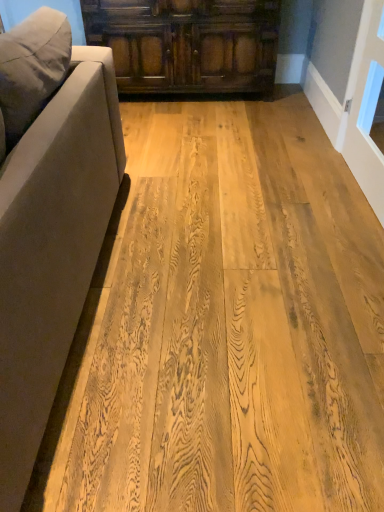
Question: In the image, is natural wood floor at center on the left side or the right side of suede-like beige couch at left?

Choices:
 (A) right
 (B) left

Answer: (A)

Question: Considering the positions of natural wood floor at center and suede-like beige couch at left in the image, is natural wood floor at center bigger or smaller than suede-like beige couch at left?

Choices:
 (A) big
 (B) small

Answer: (B)

Question: Estimate the real-world distances between objects in this image. Which object is closer to the suede-like beige couch at left?

Choices:
 (A) natural wood floor at center
 (B) dark brown wood cabinet at upper center

Answer: (A)

Question: Which object is the closest to the natural wood floor at center?

Choices:
 (A) suede-like beige couch at left
 (B) dark brown wood cabinet at upper center

Answer: (A)